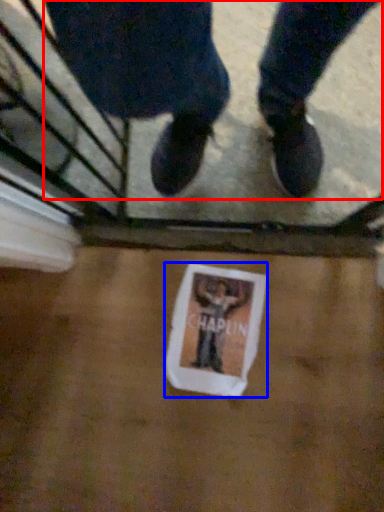
Question: Which object is further to the camera taking this photo, person (highlighted by a red box) or flyer (highlighted by a blue box)?

Choices:
 (A) person
 (B) flyer

Answer: (B)